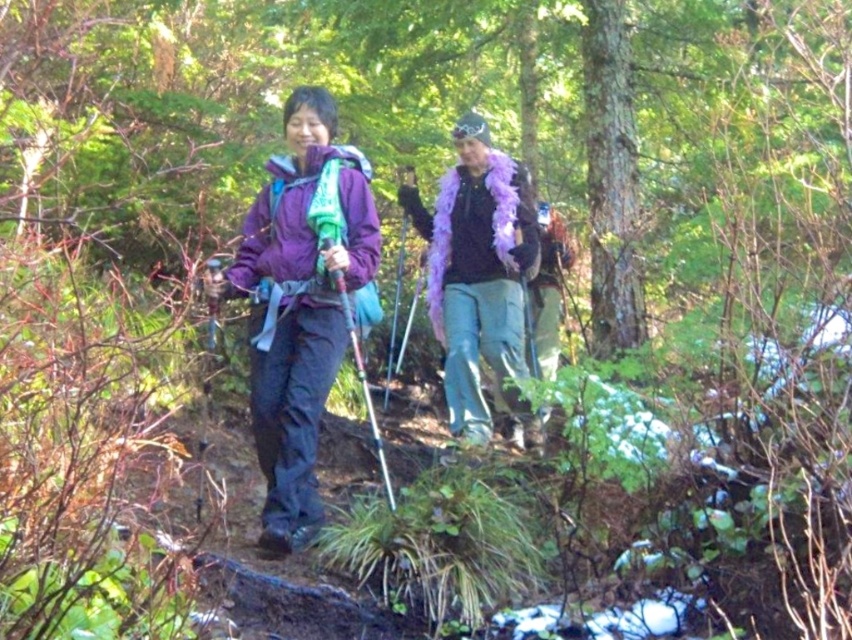
You are a photographer positioned at the origin point of the image. You want to capture a photo of the purple softshell jacket at center. What are the coordinates where you should aim your camera?

The purple softshell jacket at center is located at coordinates point (301,301). So you should aim your camera at point (301,301) to capture it.

You are a photographer aiming to capture both the purple softshell jacket at center and the purple feather boa at center in the same frame. Based on their positions, which item is positioned to the left of the other?

The purple softshell jacket at center is to the left of the purple feather boa at center.

You are a photographer trying to capture both the purple softshell jacket at center and the purple feather boa at center in a single frame. Which object should you focus on first to ensure both are in the frame without cropping?

You should focus on the purple feather boa at center first since it has a greater width than the purple softshell jacket at center, ensuring there is enough space for both in the frame.